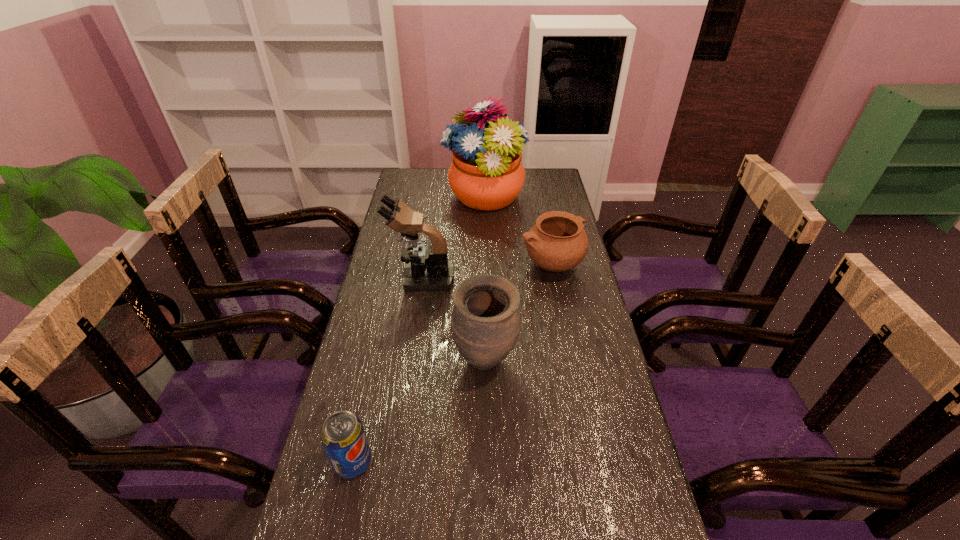
Where is `the tallest object`? The height and width of the screenshot is (540, 960). the tallest object is located at coordinates (486, 173).

This screenshot has height=540, width=960. Find the location of `the farthest object`. the farthest object is located at coordinates tap(486, 173).

Where is `the second tallest object`? This screenshot has width=960, height=540. the second tallest object is located at coordinates (427, 269).

The width and height of the screenshot is (960, 540). I want to click on the third shortest object, so click(x=485, y=323).

Identify the location of the second nearest object. Image resolution: width=960 pixels, height=540 pixels. (485, 323).

The height and width of the screenshot is (540, 960). I want to click on pottery, so click(557, 242).

The height and width of the screenshot is (540, 960). I want to click on soda, so click(x=343, y=437).

Identify the location of free spot located on the front of the flower arrangement. The image size is (960, 540). (485, 257).

Identify the location of vacant space located 0.160m on the front of the microscope. The image size is (960, 540). (415, 329).

What are the coordinates of `free space located on the left of the urn` in the screenshot? It's located at (418, 361).